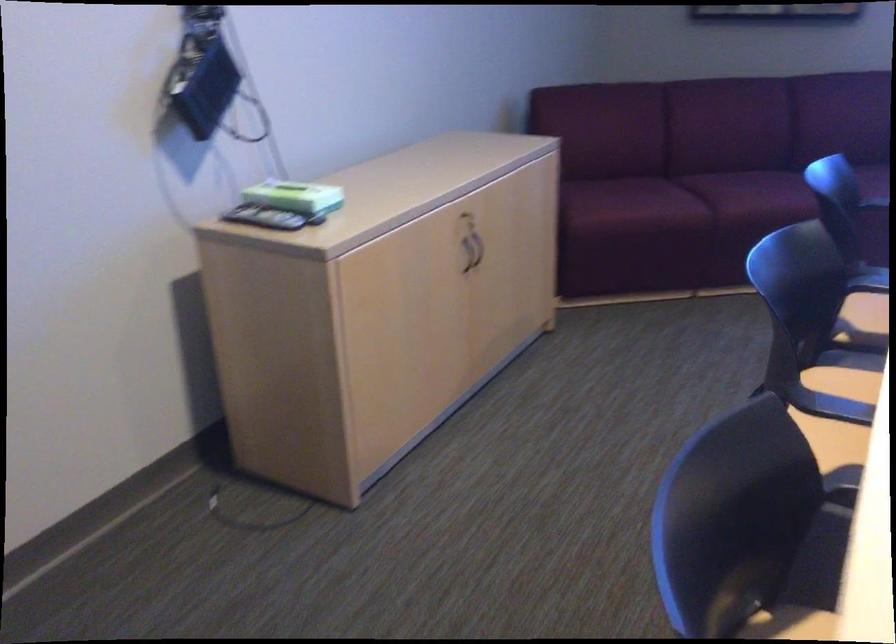
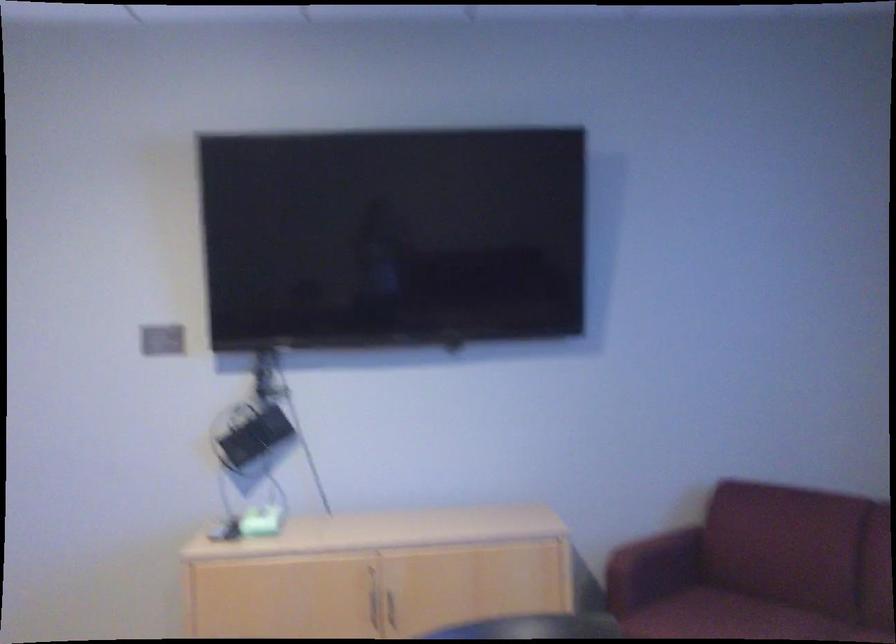
Where in the second image is the point corresponding to [469,249] from the first image?

(392, 607)